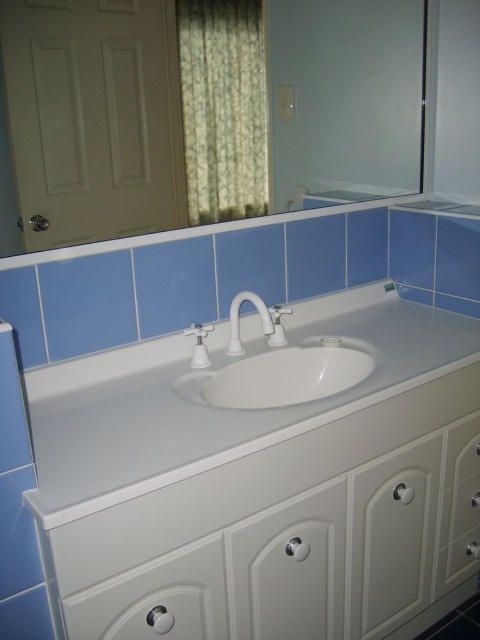
You are organizing the bathroom vanity area. You have a new white plastic soap dispenser at center that you want to place on the white glossy countertop at center. Can you fit it on the countertop?

The white glossy countertop at center has a larger size compared to the white plastic soap dispenser at center, so yes, the soap dispenser can be placed on the countertop as there is enough space.

Based on the photo, you are a bathroom designer and need to install a new mirror above the white glossy countertop at center and the white plastic soap dispenser at center. Which object should the mirror be placed above to ensure it is positioned higher?

The mirror should be placed above the white glossy countertop at center because it is taller than the white plastic soap dispenser at center, ensuring the mirror is positioned higher.

You are standing in front of the bathroom vanity and want to use the white glossy sink at center. However, there is a green floral fabric curtain at upper center in your way. Can you reach the sink without moving the curtain?

The white glossy sink at center is behind the green floral fabric curtain at upper center, so you cannot reach the sink without moving the curtain.